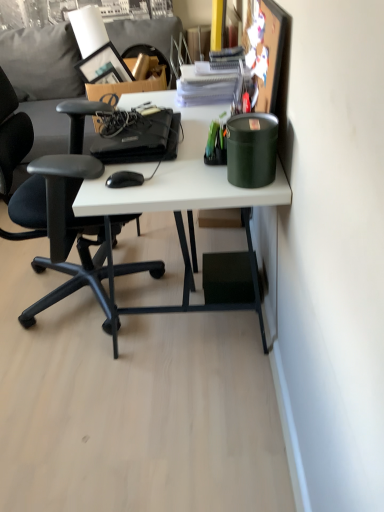
Locate an element on the screen. The image size is (384, 512). free space above black matte laptop at center (from a real-world perspective) is located at coordinates (140, 125).